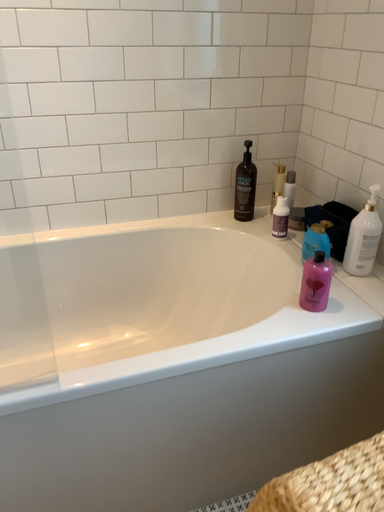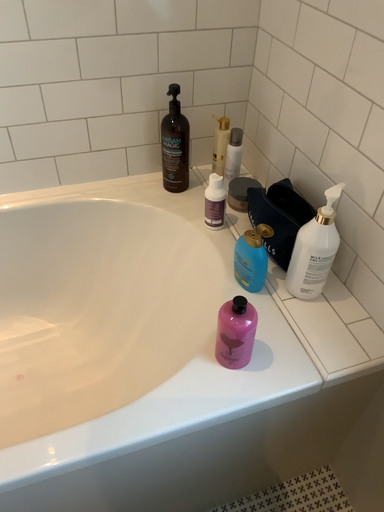
Question: Which way did the camera rotate in the video?

Choices:
 (A) rotated upward
 (B) rotated downward

Answer: (B)